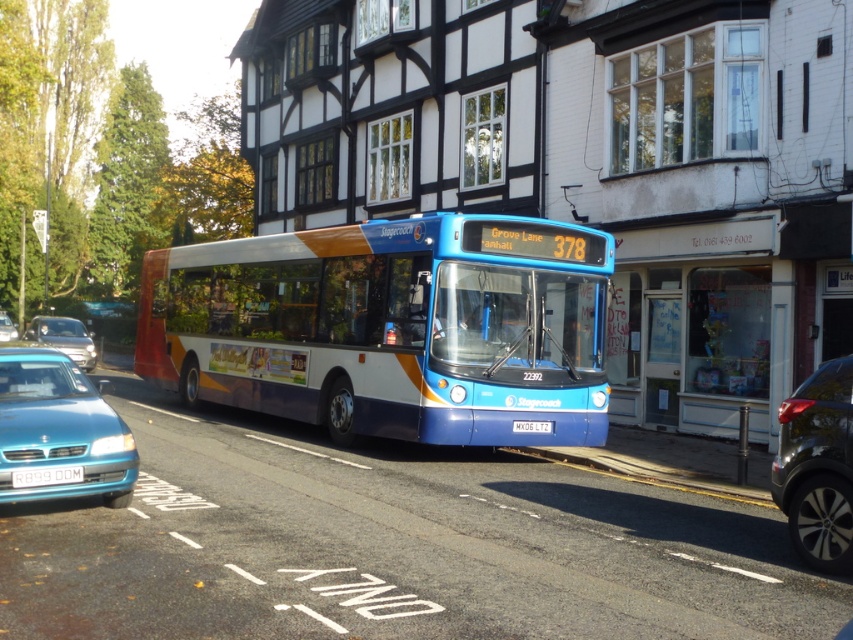
In the scene shown: You are a delivery person carrying a large package and need to enter the building through the glass door at center. There is a metallic silver car at left blocking the path. Can you walk around the car to reach the door?

The glass door at center has a smaller size compared to metallic silver car at left, so you can walk around the metallic silver car at left to reach the glass door at center, but the door itself may be too small to carry the large package through.

You are a delivery person trying to load a large package into your teal glossy sedan at lower left. The white plastic license plate at center is blocking the trunk. Can you move the license plate to make space?

The teal glossy sedan at lower left is larger than the white plastic license plate at center, so you can move the white plastic license plate at center to make space for the package.

From the picture: You are a delivery person trying to enter the building through the glass door at center. There is a metallic silver car at left blocking the entrance. Can you walk around the car to reach the door?

The glass door at center is narrower than the metallic silver car at left, so you can walk around the car to reach the door.